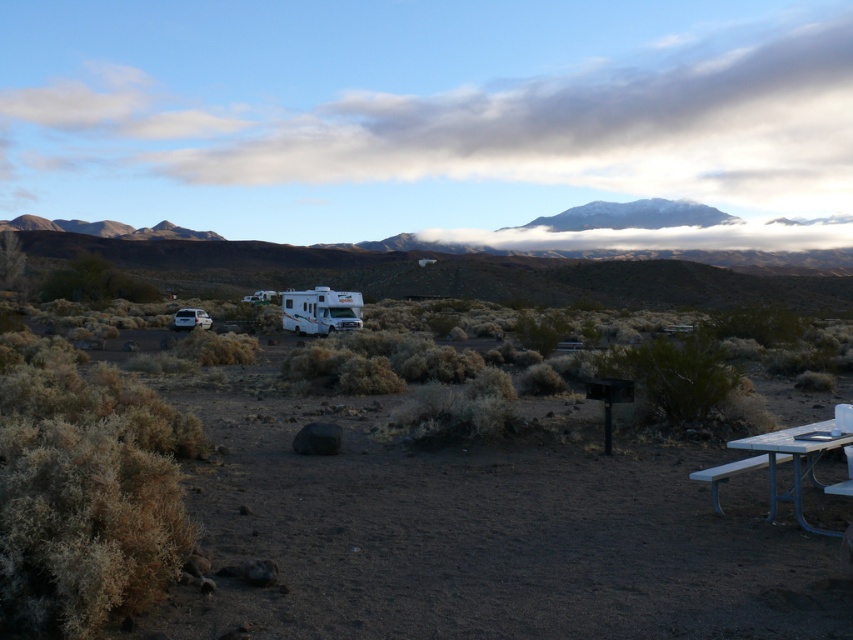
Who is more distant from viewer, (369, 506) or (184, 314)?

Point (184, 314)

Measure the distance between white plastic picnic table at center and camera.

4.41 meters

I want to click on white plastic picnic table at center, so click(474, 532).

Who is taller, snowy rock mountain at upper center or white plastic picnic table at lower right?

With more height is snowy rock mountain at upper center.

Is snowy rock mountain at upper center above white plastic picnic table at lower right?

Yes, snowy rock mountain at upper center is above white plastic picnic table at lower right.

Does point (647, 216) lie in front of point (775, 477)?

No.

Find the location of a particular element. The height and width of the screenshot is (640, 853). snowy rock mountain at upper center is located at coordinates (631, 216).

Which is more to the left, white plastic picnic table at center or snowy rock mountain at upper center?

white plastic picnic table at center is more to the left.

Is white plastic picnic table at center positioned at the back of snowy rock mountain at upper center?

No, white plastic picnic table at center is closer to the viewer.

Identify the location of white plastic picnic table at center. This screenshot has width=853, height=640. (474, 532).